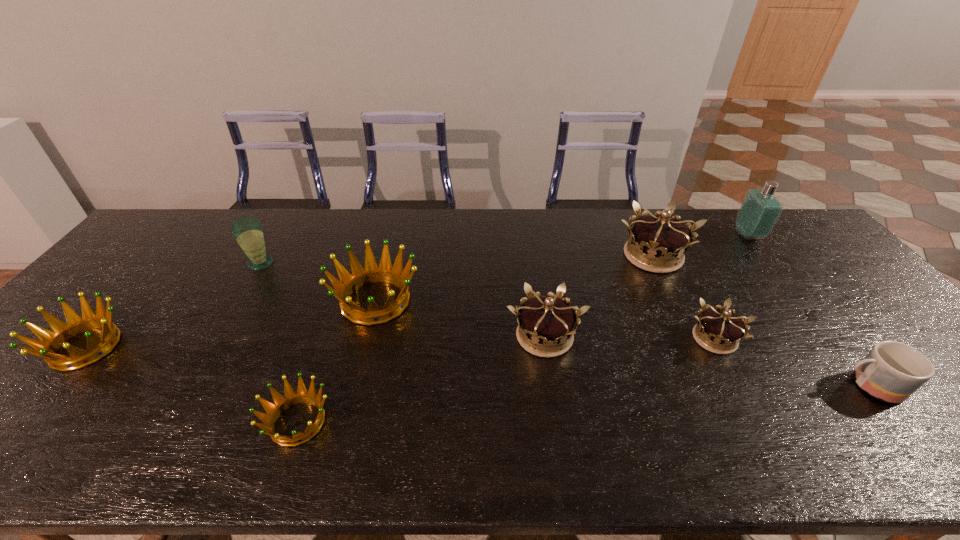
The image size is (960, 540). Identify the location of vacant space that is in between the biggest golden crown and the mug. (622, 343).

Where is `free spot between the second biggest gold crown and the mug`? The image size is (960, 540). free spot between the second biggest gold crown and the mug is located at coordinates (708, 361).

Locate an element on the screen. This screenshot has width=960, height=540. free point between the perfume and the smallest gold crown is located at coordinates (732, 287).

Find the location of `free space that is in between the biggest gold crown and the nearest crown`. free space that is in between the biggest gold crown and the nearest crown is located at coordinates (475, 339).

What are the coordinates of `object that is the fifth closest one to the fifth object from right to left` in the screenshot? It's located at (892, 371).

Locate which object ranks seventh in proximity to the leftmost object. Please provide its 2D coordinates. Your answer should be formatted as a tuple, i.e. [(x, y)], where the tuple contains the x and y coordinates of a point satisfying the conditions above.

[(892, 371)]

Find the location of a particular element. crown that is the nearest to the farthest gold crown is located at coordinates (719, 331).

Identify the location of crown identified as the third closest to the smallest gold crown. The height and width of the screenshot is (540, 960). (371, 273).

Locate which gold crown ranks third in proximity to the shortest object. Please provide its 2D coordinates. Your answer should be formatted as a tuple, i.e. [(x, y)], where the tuple contains the x and y coordinates of a point satisfying the conditions above.

[(719, 331)]

Where is `gold crown that is the second closest to the blue mug`? This screenshot has width=960, height=540. gold crown that is the second closest to the blue mug is located at coordinates (657, 243).